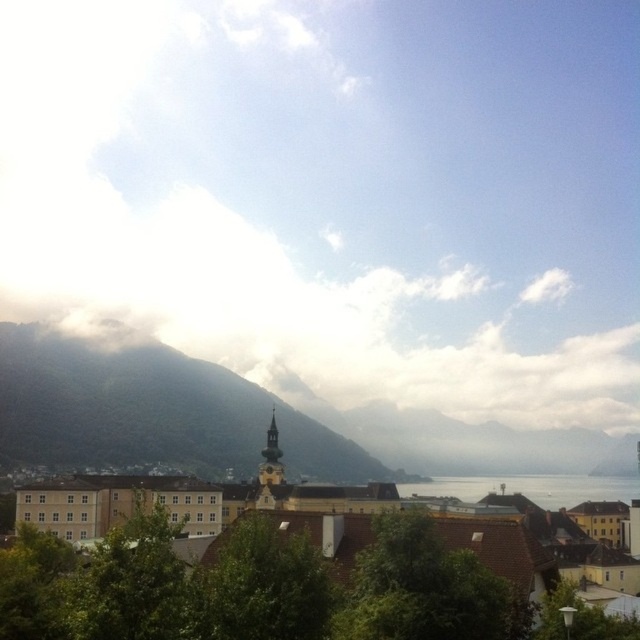
Is point (115, 397) positioned before point (570, 497)?

That is False.

Can you confirm if green textured mountain at center-left is positioned above transparent water at center?

Yes.

This screenshot has height=640, width=640. What are the coordinates of `green textured mountain at center-left` in the screenshot? It's located at (154, 413).

Can you confirm if white fluffy cloud at upper center is smaller than yellow matte building at center?

No.

Which is more to the right, white fluffy cloud at upper center or yellow matte building at center?

From the viewer's perspective, yellow matte building at center appears more on the right side.

I want to click on white fluffy cloud at upper center, so click(339, 193).

The width and height of the screenshot is (640, 640). I want to click on white fluffy cloud at upper center, so click(x=339, y=193).

Between white fluffy cloud at upper center and green textured mountain at center-left, which one is positioned lower?

Positioned lower is green textured mountain at center-left.

Where is `white fluffy cloud at upper center`? white fluffy cloud at upper center is located at coordinates (339, 193).